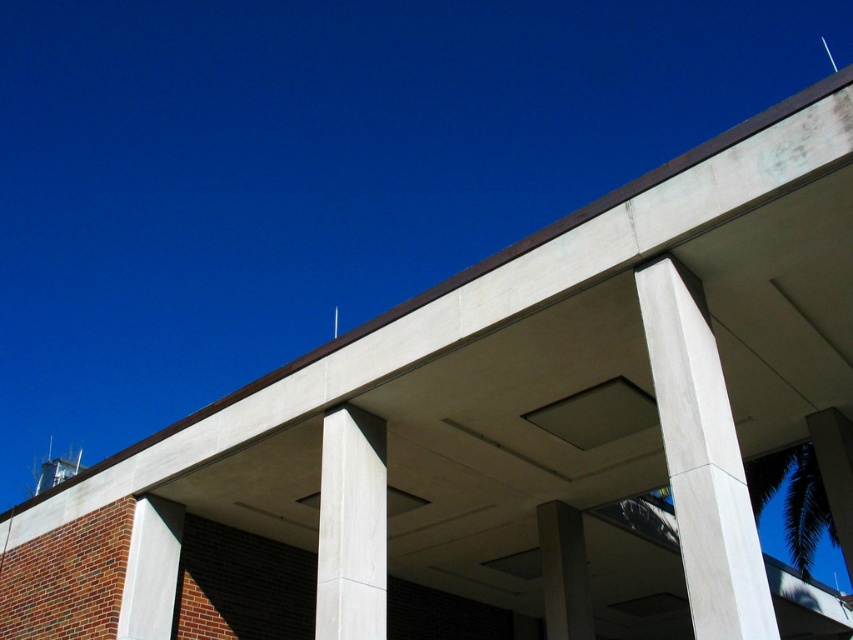
You are an architect designing a new building and want to ensure structural integrity. Given the scene, which object should you focus on reinforcing if the white smooth concrete pillar at center and the white concrete column at center are both supporting the roof?

The white smooth concrete pillar at center should be reinforced because it is larger in size than the white concrete column at center, indicating it may bear more weight.

You are an architect designing a new lighting system for the building. You need to install a spotlight at the exact center of the white smooth concrete pillar at center. What are the coordinates where you should place the spotlight?

The coordinates for the white smooth concrete pillar at center are at point (701, 460), so the spotlight should be placed at those coordinates.